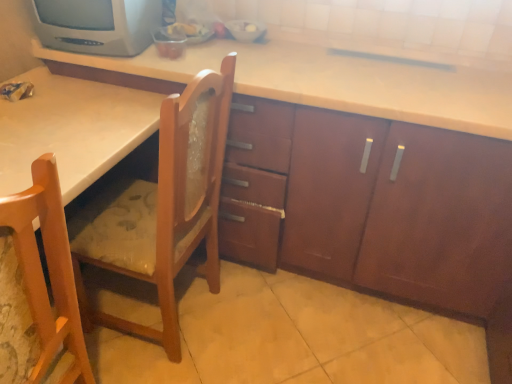
Measure the distance between point (75, 30) and camera.

They are 1.49 meters apart.

Measure the distance between matte gray crt tv at upper left and camera.

matte gray crt tv at upper left and camera are 1.41 meters apart from each other.

Measure the distance between wooden chair at center, which is the first chair from back to front, and camera.

38.10 inches.

Image resolution: width=512 pixels, height=384 pixels. What do you see at coordinates (49, 271) in the screenshot? I see `light brown wood chair at lower left, acting as the 1th chair starting from the front` at bounding box center [49, 271].

Image resolution: width=512 pixels, height=384 pixels. I want to click on matte gray crt tv at upper left, so click(97, 25).

From the picture: Is matte gray crt tv at upper left located within wooden chair at center, which is the first chair from back to front?

No, matte gray crt tv at upper left is located outside of wooden chair at center, which is the first chair from back to front.

Is wooden chair at center, which is the first chair from back to front, behind matte gray crt tv at upper left?

No, wooden chair at center, which is the first chair from back to front, is closer to the viewer.

In the scene shown: Is wooden chair at center, which is the first chair from back to front, facing towards matte gray crt tv at upper left?

No, wooden chair at center, which is the first chair from back to front, is not facing towards matte gray crt tv at upper left.

In the scene shown: Can you confirm if wooden chair at center, which is the first chair from back to front, is positioned to the left of matte gray crt tv at upper left?

Incorrect, wooden chair at center, which is the first chair from back to front, is not on the left side of matte gray crt tv at upper left.

Find the location of `chair behind the light brown wood chair at lower left, which is the 2th chair from back to front`. chair behind the light brown wood chair at lower left, which is the 2th chair from back to front is located at coordinates (166, 208).

Is wooden chair at center, acting as the 2th chair starting from the front, positioned behind light brown wood chair at lower left, acting as the 1th chair starting from the front?

Yes, it is.

Considering the relative sizes of light brown wood chair at lower left, acting as the 1th chair starting from the front, and matte gray crt tv at upper left in the image provided, is light brown wood chair at lower left, acting as the 1th chair starting from the front, smaller than matte gray crt tv at upper left?

Incorrect, light brown wood chair at lower left, acting as the 1th chair starting from the front, is not smaller in size than matte gray crt tv at upper left.

Is point (50, 197) behind point (71, 24)?

No, (50, 197) is closer to viewer.

From a real-world perspective, is light brown wood chair at lower left, acting as the 1th chair starting from the front, positioned under matte gray crt tv at upper left based on gravity?

Correct, in the physical world, light brown wood chair at lower left, acting as the 1th chair starting from the front, is lower than matte gray crt tv at upper left.

Between matte gray crt tv at upper left and wooden chair at center, acting as the 2th chair starting from the front, which one has smaller size?

matte gray crt tv at upper left is smaller.

Looking at this image, is matte gray crt tv at upper left oriented towards wooden chair at center, acting as the 2th chair starting from the front?

No, matte gray crt tv at upper left is not oriented towards wooden chair at center, acting as the 2th chair starting from the front.

Considering the positions of objects matte gray crt tv at upper left and light brown wood chair at lower left, which is the 2th chair from back to front, in the image provided, who is more to the right, matte gray crt tv at upper left or light brown wood chair at lower left, which is the 2th chair from back to front,?

Positioned to the right is matte gray crt tv at upper left.

Is point (146, 6) behind point (0, 230)?

Yes, it is.

Is matte gray crt tv at upper left far from light brown wood chair at lower left, acting as the 1th chair starting from the front?

They are positioned close to each other.

In terms of size, does matte gray crt tv at upper left appear bigger or smaller than light brown wood chair at lower left, acting as the 1th chair starting from the front?

Clearly, matte gray crt tv at upper left is smaller in size than light brown wood chair at lower left, acting as the 1th chair starting from the front.

Looking at this image, how different are the orientations of light brown wood chair at lower left, which is the 2th chair from back to front, and wooden chair at center, which is the first chair from back to front, in degrees?

4.94 degrees separate the facing orientations of light brown wood chair at lower left, which is the 2th chair from back to front, and wooden chair at center, which is the first chair from back to front.

Looking at this image, can you see light brown wood chair at lower left, which is the 2th chair from back to front, touching wooden chair at center, which is the first chair from back to front?

No, light brown wood chair at lower left, which is the 2th chair from back to front, is not beside wooden chair at center, which is the first chair from back to front.

Identify the location of chair below the wooden chair at center, which is the first chair from back to front (from the image's perspective). This screenshot has height=384, width=512. (49, 271).

Which is behind, point (42, 334) or point (178, 134)?

Point (178, 134)

I want to click on chair on the right of matte gray crt tv at upper left, so pyautogui.click(x=166, y=208).

The width and height of the screenshot is (512, 384). I want to click on chair below the wooden chair at center, which is the first chair from back to front (from the image's perspective), so click(x=49, y=271).

Which object lies further to the anchor point matte gray crt tv at upper left, wooden chair at center, which is the first chair from back to front, or light brown wood chair at lower left, which is the 2th chair from back to front?

The object further to matte gray crt tv at upper left is light brown wood chair at lower left, which is the 2th chair from back to front.

Looking at the image, which one is located closer to matte gray crt tv at upper left, light brown wood chair at lower left, which is the 2th chair from back to front, or wooden chair at center, acting as the 2th chair starting from the front?

wooden chair at center, acting as the 2th chair starting from the front.

From the image, which object appears to be nearer to wooden chair at center, acting as the 2th chair starting from the front, matte gray crt tv at upper left or light brown wood chair at lower left, acting as the 1th chair starting from the front?

light brown wood chair at lower left, acting as the 1th chair starting from the front.

From the image, which object appears to be nearer to wooden chair at center, which is the first chair from back to front, light brown wood chair at lower left, acting as the 1th chair starting from the front, or matte gray crt tv at upper left?

→ Among the two, light brown wood chair at lower left, acting as the 1th chair starting from the front, is located nearer to wooden chair at center, which is the first chair from back to front.

Estimate the real-world distances between objects in this image. Which object is further from light brown wood chair at lower left, acting as the 1th chair starting from the front, matte gray crt tv at upper left or wooden chair at center, which is the first chair from back to front?

Based on the image, matte gray crt tv at upper left appears to be further to light brown wood chair at lower left, acting as the 1th chair starting from the front.

Which object lies nearer to the anchor point light brown wood chair at lower left, which is the 2th chair from back to front, wooden chair at center, which is the first chair from back to front, or matte gray crt tv at upper left?

Among the two, wooden chair at center, which is the first chair from back to front, is located nearer to light brown wood chair at lower left, which is the 2th chair from back to front.

This screenshot has width=512, height=384. I want to click on chair between matte gray crt tv at upper left and light brown wood chair at lower left, which is the 2th chair from back to front, vertically, so click(x=166, y=208).